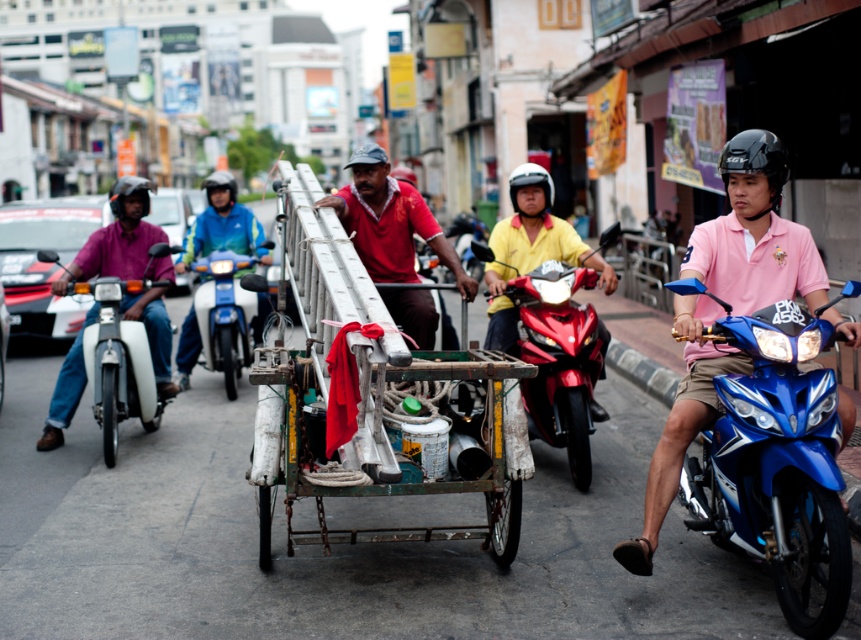
Question: Considering the real-world distances, which object is closest to the matte white motorcycle at left?

Choices:
 (A) blue metallic motorcycle at right
 (B) shiny red motorcycle at center

Answer: (B)

Question: Considering the relative positions of blue metallic motorcycle at right and matte black helmet at center in the image provided, where is blue metallic motorcycle at right located with respect to matte black helmet at center?

Choices:
 (A) below
 (B) above

Answer: (A)

Question: Which is farther from the red matte shirt at center?

Choices:
 (A) rusty metal cart at center
 (B) matte black helmet at center

Answer: (B)

Question: Where is pink cotton shirt at right located in relation to white matte helmet at center in the image?

Choices:
 (A) right
 (B) left

Answer: (A)

Question: Among these points, which one is nearest to the camera?

Choices:
 (A) (116, 368)
 (B) (807, 596)
 (C) (769, 205)

Answer: (B)

Question: Is matte black helmet at left wider than matte black helmet at upper center?

Choices:
 (A) yes
 (B) no

Answer: (B)